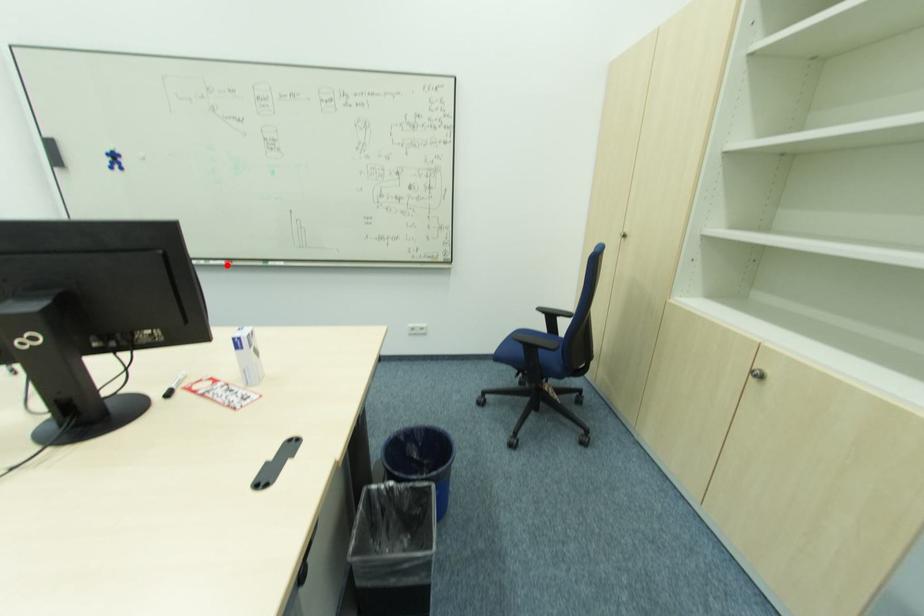
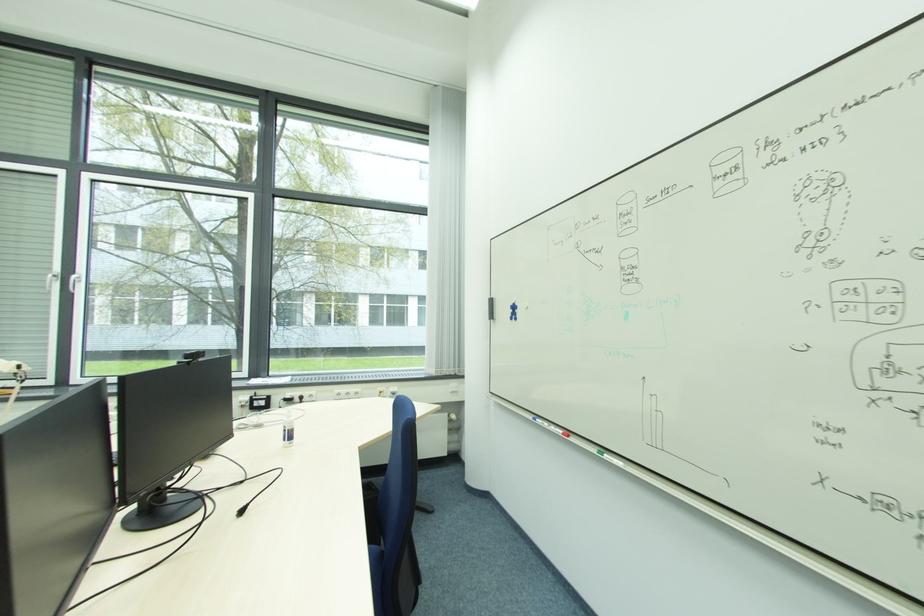
In the second image, find the point that corresponds to the highlighted location in the first image.

(563, 434)